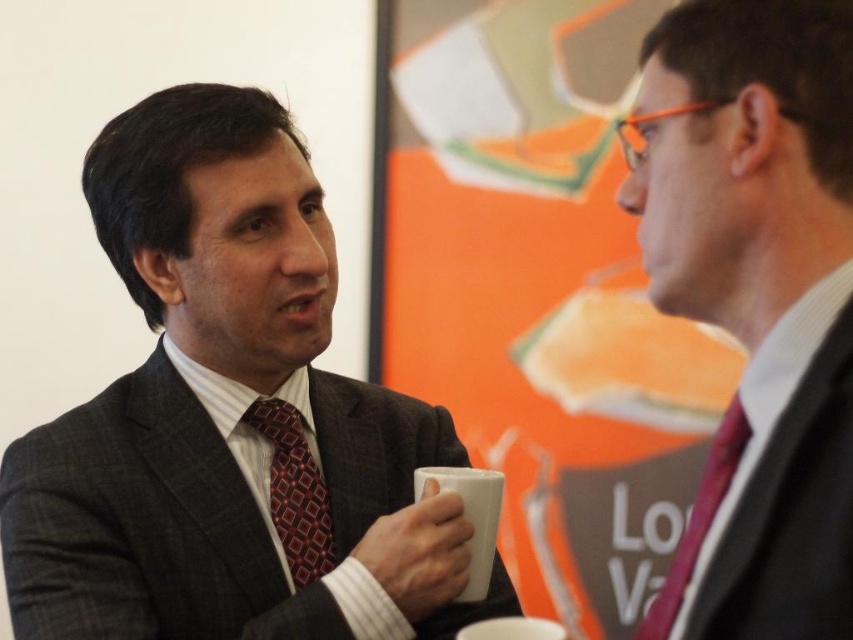
Question: Is matte black suit at right bigger than white ceramic mug at center?

Choices:
 (A) no
 (B) yes

Answer: (B)

Question: Which object is farther from the camera taking this photo?

Choices:
 (A) white matte mug at center
 (B) dark red textured tie at left

Answer: (B)

Question: Which point appears closest to the camera in this image?

Choices:
 (A) (131, 561)
 (B) (717, 292)
 (C) (521, 634)
 (D) (724, 488)

Answer: (B)

Question: Does dark red textured tie at left appear on the right side of white ceramic mug at center?

Choices:
 (A) yes
 (B) no

Answer: (B)

Question: Is matte black suit at left thinner than matte black suit at right?

Choices:
 (A) yes
 (B) no

Answer: (B)

Question: Among these points, which one is nearest to the camera?

Choices:
 (A) (639, 188)
 (B) (526, 627)
 (C) (448, 492)
 (D) (735, 412)

Answer: (D)